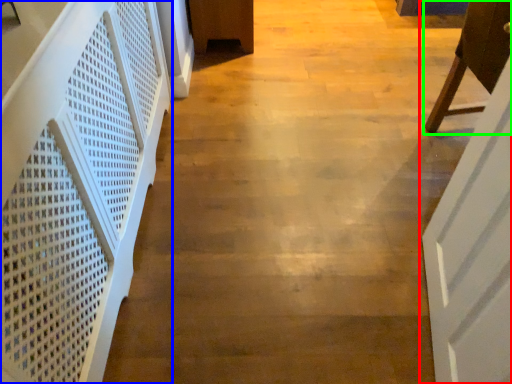
Question: Estimate the real-world distances between objects in this image. Which object is closer to door (highlighted by a red box), stairwell (highlighted by a blue box) or furniture (highlighted by a green box)?

Choices:
 (A) stairwell
 (B) furniture

Answer: (B)